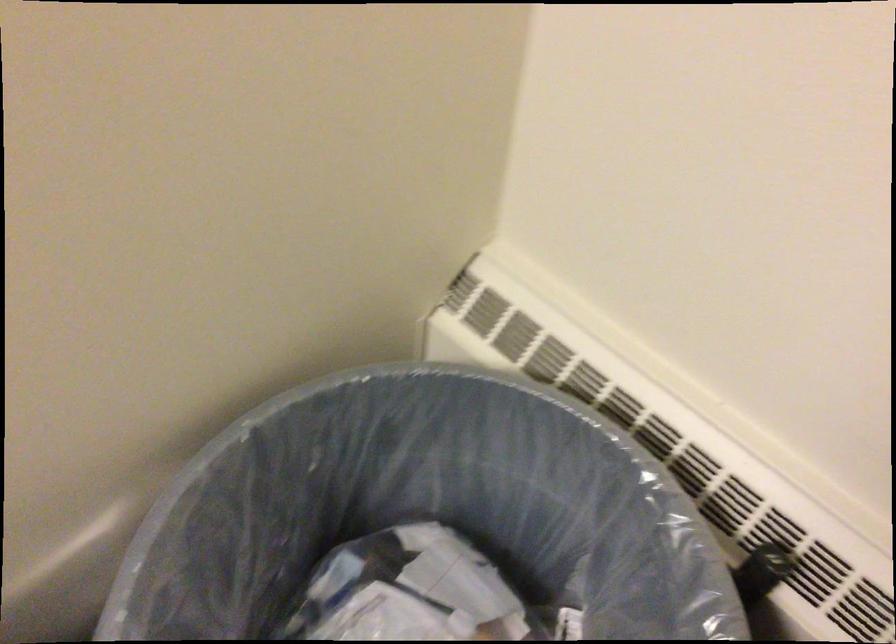
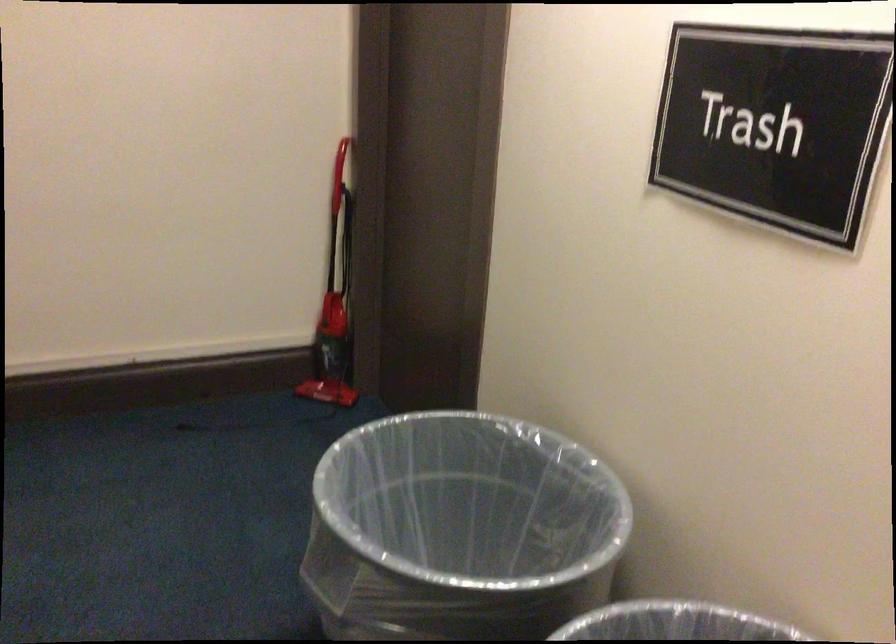
First-person continuous shooting, in which direction is the camera rotating?

The rotation direction of the camera is left-down.